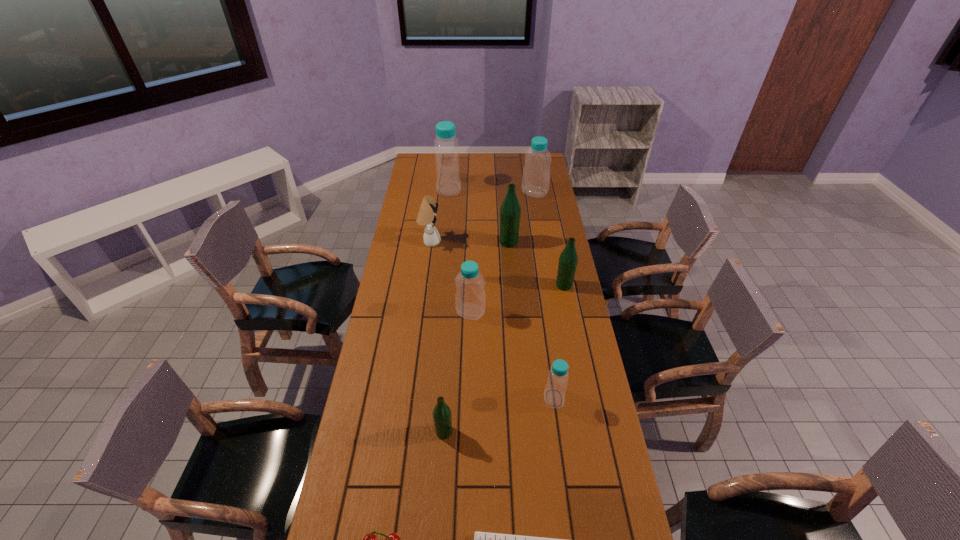
Identify the location of free spot located 0.260m on the front of the third nearest object. The image size is (960, 540). (438, 536).

At what (x,y) coordinates should I click in order to perform the action: click on vacant space situated 0.300m on the back of the seventh farthest object. Please return your answer as a coordinate pair (x, y). Image resolution: width=960 pixels, height=540 pixels. Looking at the image, I should click on (543, 319).

Image resolution: width=960 pixels, height=540 pixels. In order to click on bottle that is positioned at the left edge in this screenshot , I will do `click(448, 183)`.

This screenshot has height=540, width=960. What are the coordinates of `doll that is at the left edge` in the screenshot? It's located at (426, 217).

Identify the location of vacant space at the far edge. (502, 173).

The height and width of the screenshot is (540, 960). In the image, there is a desktop. Identify the location of free space at the left edge. (367, 497).

Image resolution: width=960 pixels, height=540 pixels. Identify the location of vacant space at the right edge. (536, 269).

Find the location of `empty space between the doll and the second farthest green bottle`. empty space between the doll and the second farthest green bottle is located at coordinates (497, 264).

Locate an element on the screen. This screenshot has width=960, height=540. free point between the seventh farthest object and the second biggest blue bottle is located at coordinates (544, 295).

The height and width of the screenshot is (540, 960). Find the location of `vacant area that lies between the rightmost green bottle and the farthest green bottle`. vacant area that lies between the rightmost green bottle and the farthest green bottle is located at coordinates (537, 264).